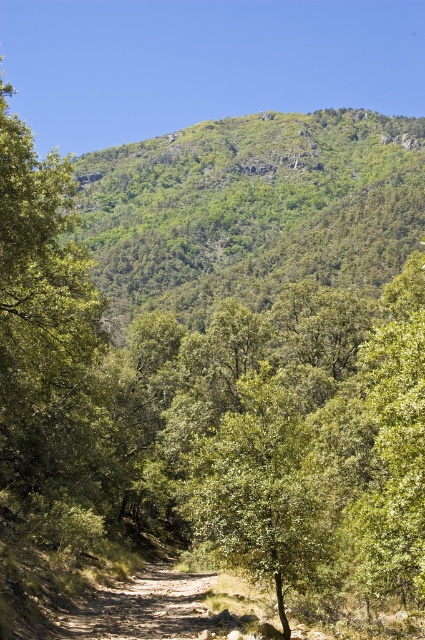
Is point (278, 259) farther from camera compared to point (275, 522)?

Yes, it is behind point (275, 522).

Which is below, green leafy hillside at upper center or green leafy tree at center?

Positioned lower is green leafy tree at center.

Between point (221, 122) and point (204, 451), which one is positioned in front?

Point (204, 451) is more forward.

Find the location of a particular element. The width and height of the screenshot is (425, 640). green leafy hillside at upper center is located at coordinates (252, 209).